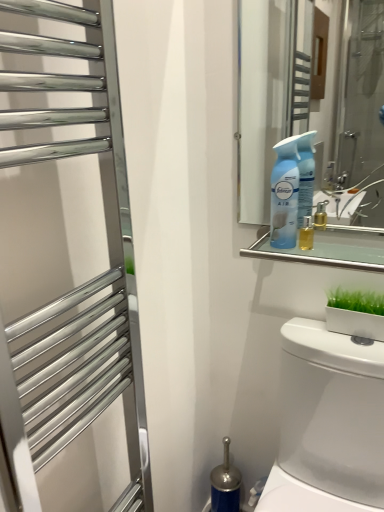
Question: From a real-world perspective, is polished chrome towel rack at left physically located above or below white glossy toilet at lower right?

Choices:
 (A) above
 (B) below

Answer: (A)

Question: Considering the positions of polished chrome towel rack at left and white glossy toilet at lower right in the image, is polished chrome towel rack at left wider or thinner than white glossy toilet at lower right?

Choices:
 (A) wide
 (B) thin

Answer: (B)

Question: Estimate the real-world distances between objects in this image. Which object is closer to the white glossy toilet at lower right?

Choices:
 (A) blue plastic spray bottle at upper right
 (B) polished chrome towel rack at left
 (C) green matte planter at lower right
 (D) clear glass mirror at upper center

Answer: (C)

Question: Based on their relative distances, which object is farther from the blue plastic spray bottle at upper right?

Choices:
 (A) green matte planter at lower right
 (B) clear glass mirror at upper center
 (C) polished chrome towel rack at left
 (D) white glossy toilet at lower right

Answer: (C)